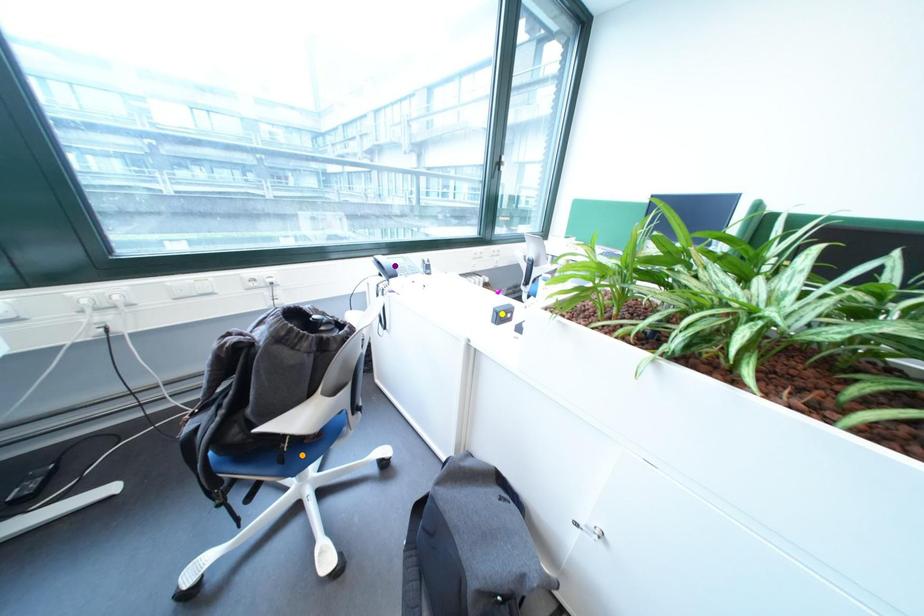
Order these from farthest to nearest:
A) purple point
B) orange point
C) yellow point

1. purple point
2. yellow point
3. orange point